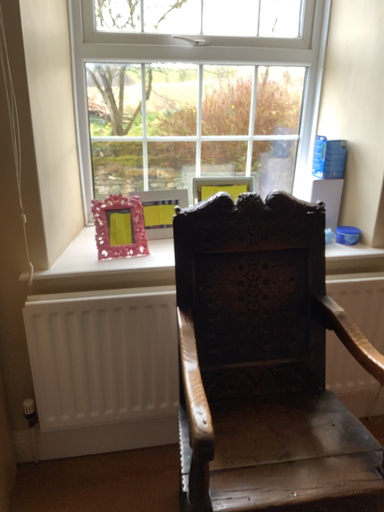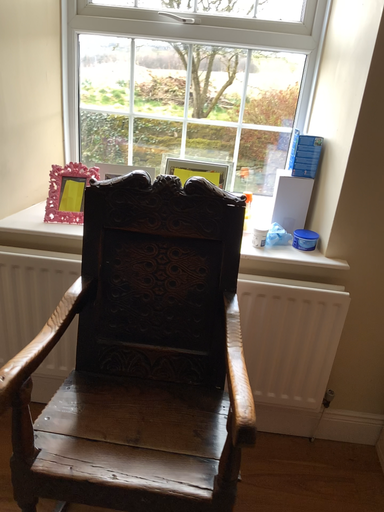
Question: Which way did the camera rotate in the video?

Choices:
 (A) rotated left
 (B) rotated right

Answer: (A)